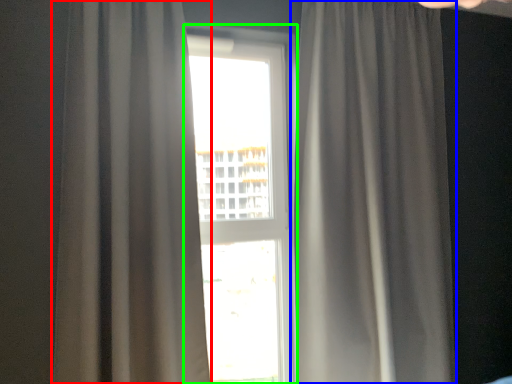
Question: Which is farther away from curtain (highlighted by a red box)? curtain (highlighted by a blue box) or window (highlighted by a green box)?

Choices:
 (A) curtain
 (B) window

Answer: (B)